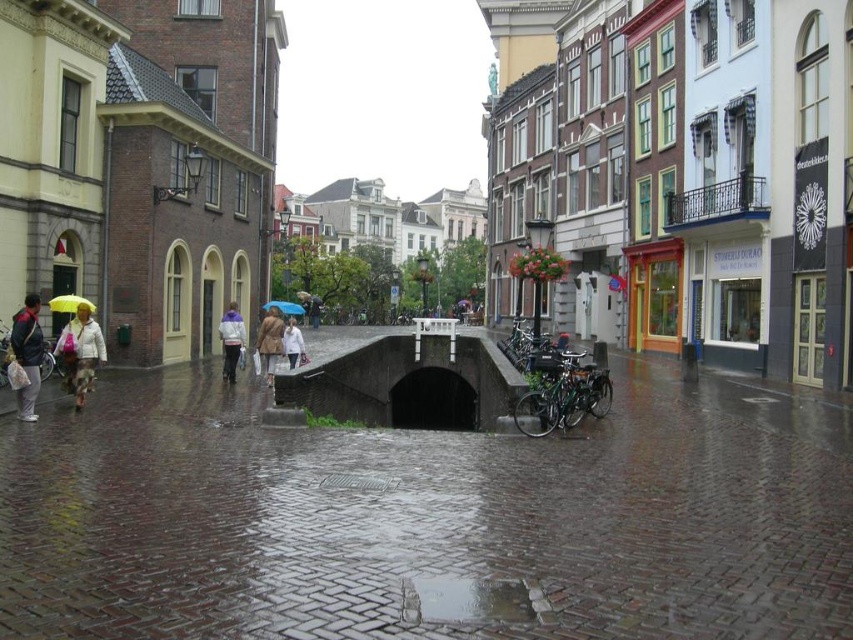
Is point (815, 419) positioned after point (268, 342)?

That is False.

Based on the photo, is wet cobblestone pavement at center to the right of brown leather coat at center from the viewer's perspective?

Indeed, wet cobblestone pavement at center is positioned on the right side of brown leather coat at center.

Is point (206, 616) positioned after point (271, 378)?

That is False.

Where is `wet cobblestone pavement at center`? wet cobblestone pavement at center is located at coordinates (427, 516).

Consider the image. Who is higher up, yellow matte umbrella at left or blue matte umbrella at center?

Positioned higher is blue matte umbrella at center.

Consider the image. Can you confirm if yellow matte umbrella at left is wider than blue matte umbrella at center?

In fact, yellow matte umbrella at left might be narrower than blue matte umbrella at center.

Which is behind, point (74, 301) or point (286, 312)?

The point (286, 312) is more distant.

You are a GUI agent. You are given a task and a screenshot of the screen. Output one action in this format:
    pyautogui.click(x=<x>, y=<y>)
    Task: Click on the yellow matte umbrella at left
    
    Given the screenshot: What is the action you would take?
    pyautogui.click(x=68, y=304)

Which is above, wet cobblestone pavement at center or purple fleece jacket at center?

purple fleece jacket at center

Between point (42, 461) and point (225, 332), which one is positioned in front?

Point (42, 461)

Does point (161, 518) come closer to viewer compared to point (230, 314)?

Yes.

Image resolution: width=853 pixels, height=640 pixels. I want to click on wet cobblestone pavement at center, so click(427, 516).